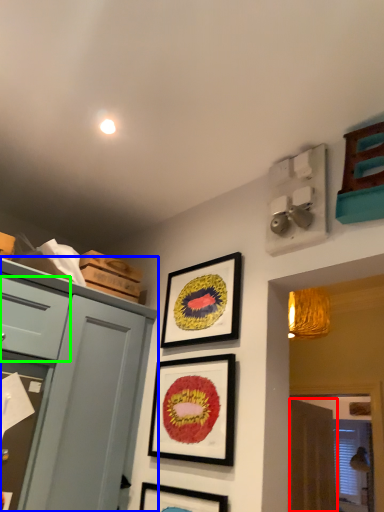
Question: Estimate the real-world distances between objects in this image. Which object is closer to curtain (highlighted by a red box), cabinetry (highlighted by a blue box) or drawer (highlighted by a green box)?

Choices:
 (A) cabinetry
 (B) drawer

Answer: (A)